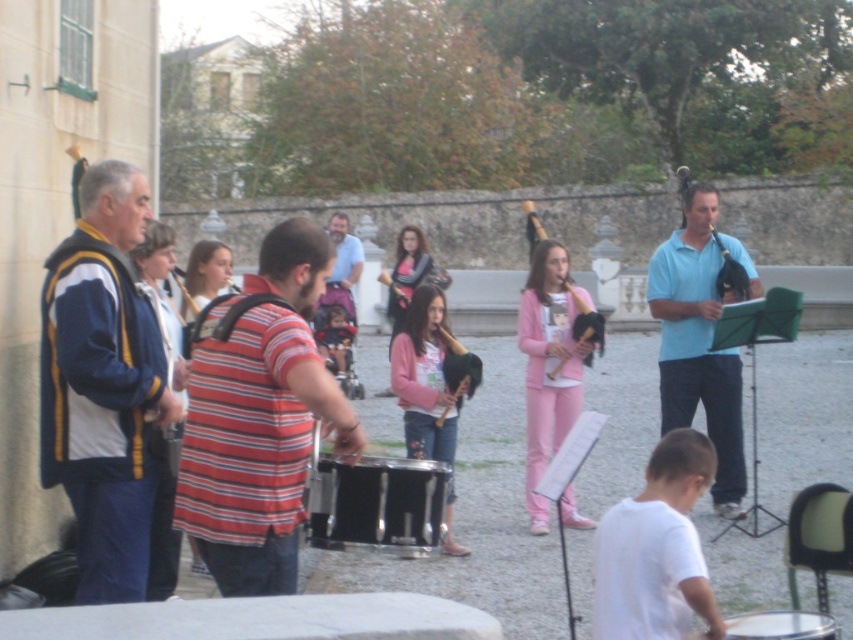
You are a photographer trying to capture a photo of the blue and yellow jacket at left and the wooden flute at center. Based on their heights, which object should you focus on first if you want to ensure both are in frame without adjusting your camera angle?

The blue and yellow jacket at left has a lesser height compared to the wooden flute at center, so you should focus on the wooden flute at center first to ensure both are in frame.

You are standing in the courtyard and want to hand a music sheet to the person wearing the blue and yellow jacket at left. The music sheet is currently on the wooden flute at center. Which direction should you move to reach the jacket first?

The blue and yellow jacket at left is positioned under the wooden flute at center, so you should move towards the area below the wooden flute at center to reach the jacket first.

You are standing at the center of the courtyard and want to hand a sheet of music to the person wearing the striped cotton shirt at center. If you walk straight ahead, will you reach them before the wall on the left blocks your path?

Yes, because the distance between you and the striped cotton shirt at center is 15.19 feet, which is greater than the distance to the wall on the left. Therefore, you can reach them before the wall blocks your path.